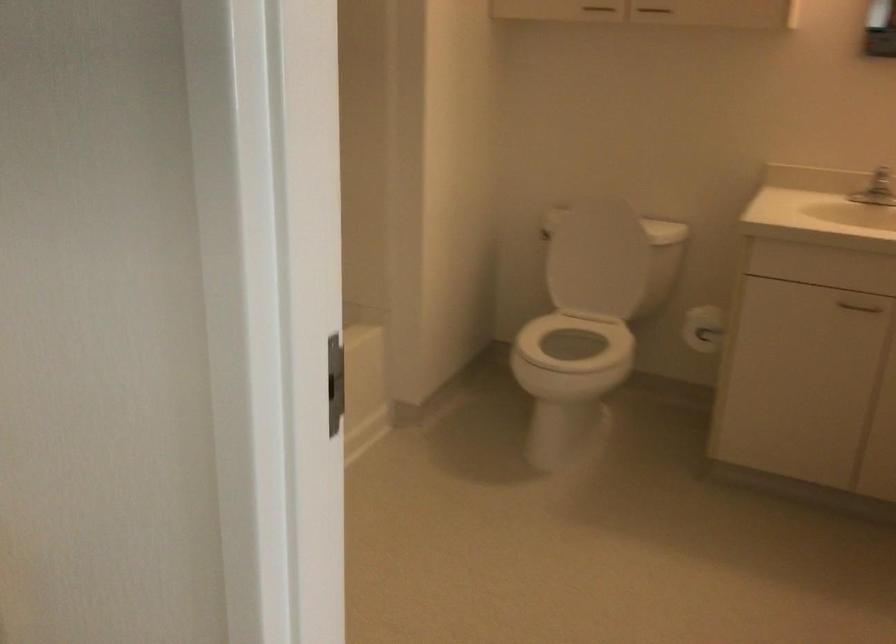
This screenshot has width=896, height=644. I want to click on silver faucet handle, so click(881, 182).